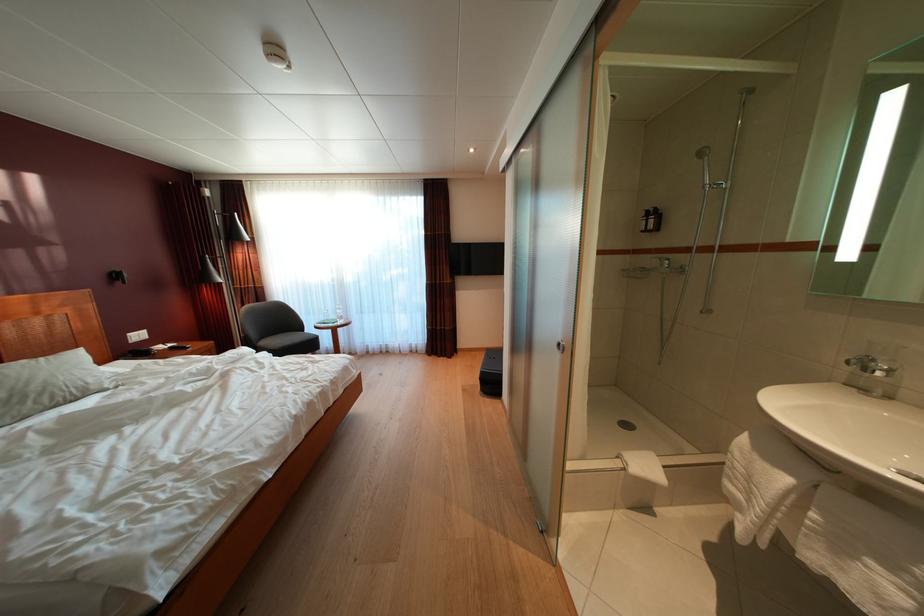
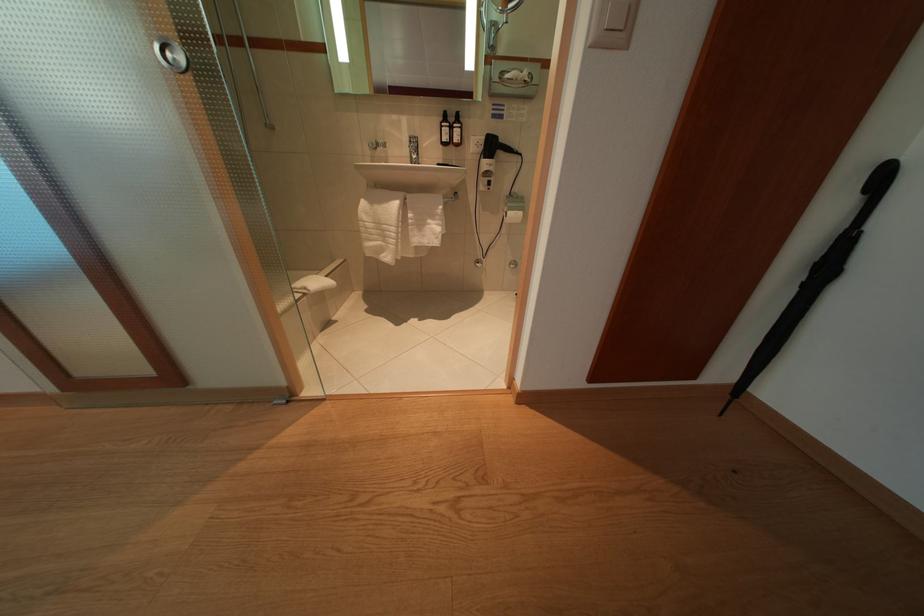
From the picture: How did the camera likely rotate?

The camera rotated toward right-down.